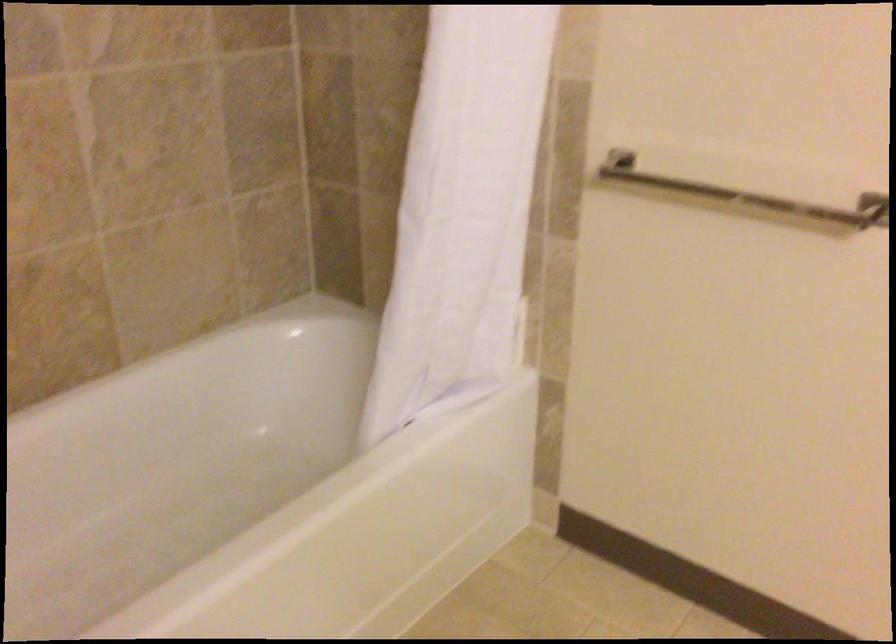
Find where to grabb the metal towel rack. Please return your answer as a coordinate pair (x, y).

(745, 194)